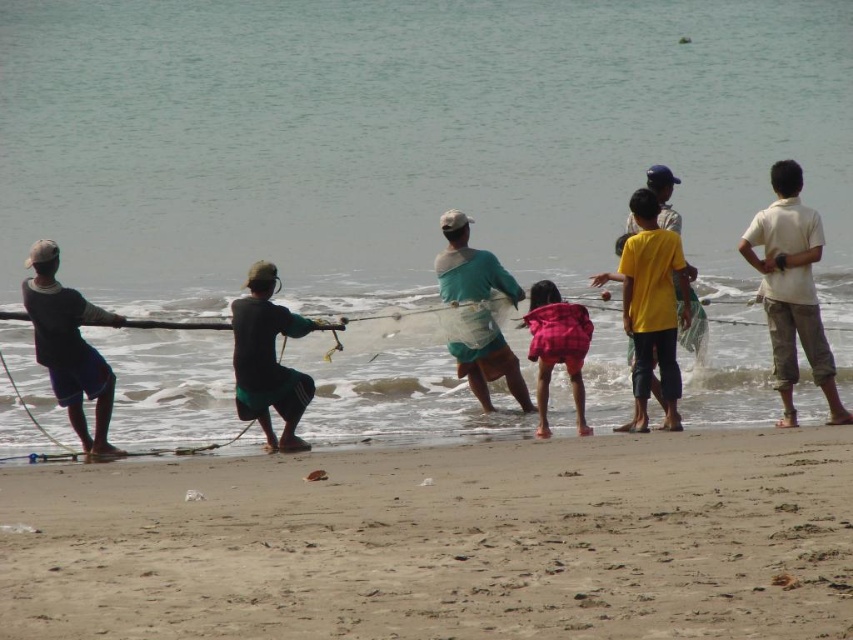
Question: Does dark blue fabric fisherman at left appear over teal fabric shirt at center?

Choices:
 (A) no
 (B) yes

Answer: (B)

Question: Is clear water at lower center above teal fabric shirt at center?

Choices:
 (A) no
 (B) yes

Answer: (B)

Question: Among these objects, which one is farthest from the camera?

Choices:
 (A) clear water at lower center
 (B) sandy beach at lower center

Answer: (A)

Question: Which object is closer to the camera taking this photo?

Choices:
 (A) pink plaid shirt at center
 (B) dark blue fabric fisherman at left

Answer: (B)

Question: Which of the following is the farthest from the observer?

Choices:
 (A) black matte shorts at center
 (B) dark blue fabric fisherman at left
 (C) teal fabric shirt at center
 (D) clear water at lower center

Answer: (C)

Question: Is teal fabric shirt at center above pink plaid shirt at center?

Choices:
 (A) no
 (B) yes

Answer: (A)